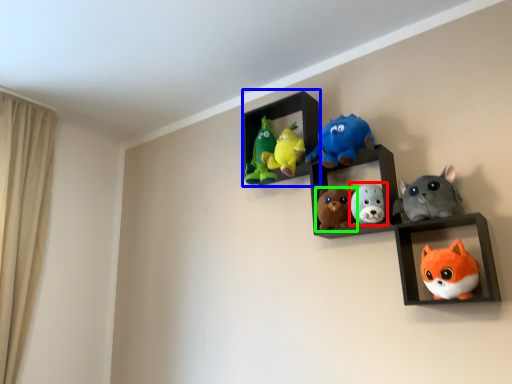
Question: Estimate the real-world distances between objects in this image. Which object is farther from toy (highlighted by a red box), cabinet (highlighted by a blue box) or toy (highlighted by a green box)?

Choices:
 (A) cabinet
 (B) toy

Answer: (A)